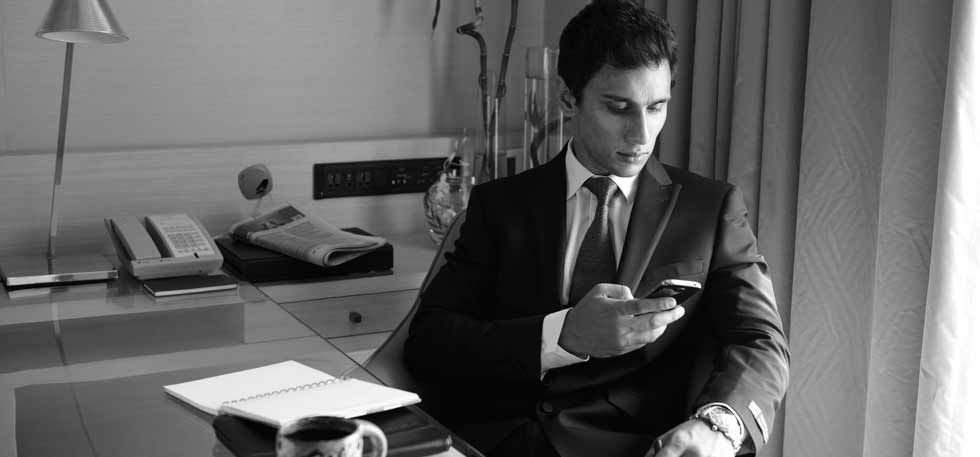
Identify the location of lamp. (75, 22).